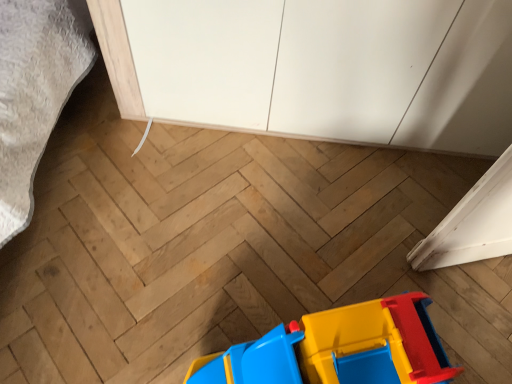
Locate an element on the screen. vacant space that is in between white matte cabinet at upper center and matte plastic toy at lower center is located at coordinates (294, 223).